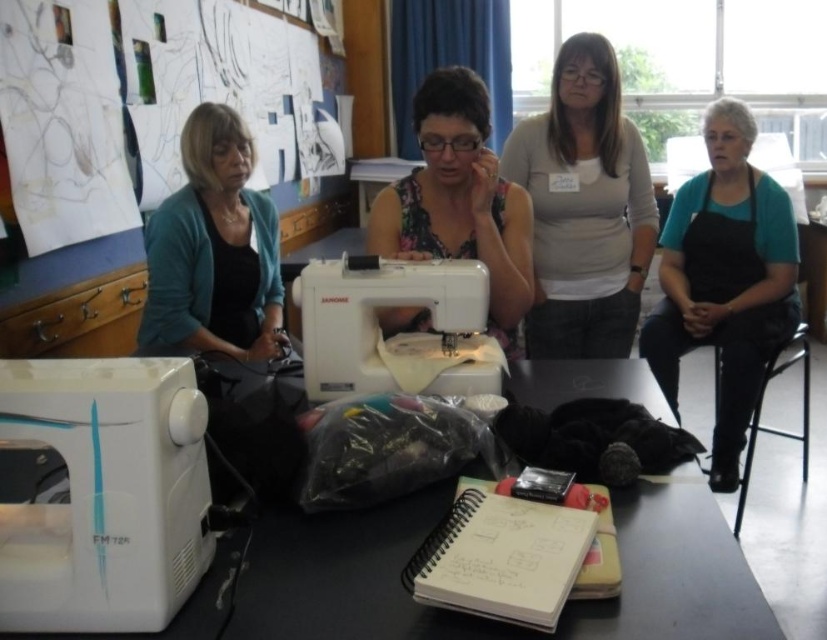
Question: Does white plastic sewing machine at lower left have a lesser width compared to black plastic stool at lower right?

Choices:
 (A) yes
 (B) no

Answer: (A)

Question: Considering the real-world distances, which object is closest to the white plastic table at center?

Choices:
 (A) white plastic sewing machine at lower left
 (B) white plastic sewing machine at center
 (C) floral fabric at center

Answer: (A)

Question: Does teal fabric apron at right come in front of floral fabric at center?

Choices:
 (A) no
 (B) yes

Answer: (A)

Question: Which object is farther from the camera taking this photo?

Choices:
 (A) teal fabric apron at right
 (B) white plastic table at center
 (C) white plastic sewing machine at center
 (D) white plastic sewing machine at lower left

Answer: (A)

Question: Does teal fabric apron at right have a greater width compared to white plastic sewing machine at center?

Choices:
 (A) no
 (B) yes

Answer: (B)

Question: Which point is closer to the camera taking this photo?

Choices:
 (A) (744, 460)
 (B) (228, 272)
 (C) (189, 630)
 (D) (376, 339)

Answer: (C)